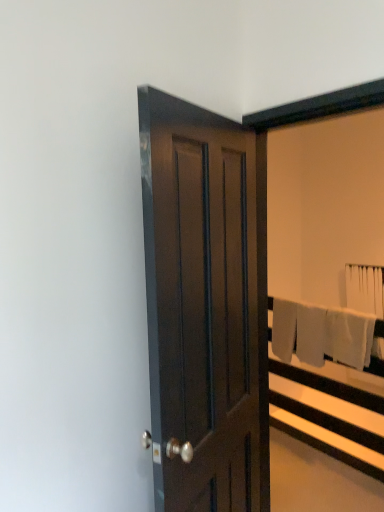
Question: From the image's perspective, is dark wood door at center below white cotton bath towel at right, which is the second bath towel in back-to-front order?

Choices:
 (A) yes
 (B) no

Answer: (B)

Question: Does dark wood door at center appear on the right side of white cotton bath towel at right, positioned as the 1th bath towel in bottom-to-top order?

Choices:
 (A) yes
 (B) no

Answer: (B)

Question: From a real-world perspective, is dark wood door at center beneath white cotton bath towel at right, marked as the 2th bath towel in a top-to-bottom arrangement?

Choices:
 (A) yes
 (B) no

Answer: (B)

Question: Is dark wood door at center smaller than white cotton bath towel at right, acting as the 2th bath towel starting from the right?

Choices:
 (A) yes
 (B) no

Answer: (B)

Question: Could you tell me if dark wood door at center is turned towards white cotton bath towel at right, marked as the 2th bath towel in a top-to-bottom arrangement?

Choices:
 (A) yes
 (B) no

Answer: (B)

Question: From a real-world perspective, does dark wood door at center stand above white cotton bath towel at right, the first bath towel when ordered from front to back?

Choices:
 (A) yes
 (B) no

Answer: (A)

Question: Can you confirm if dark wood door at center is positioned to the left of white fabric bath towel at upper right, arranged as the 2th bath towel when viewed from the front?

Choices:
 (A) yes
 (B) no

Answer: (A)

Question: Is white fabric bath towel at upper right, which appears as the second bath towel when viewed from the left, at the back of dark wood door at center?

Choices:
 (A) yes
 (B) no

Answer: (B)

Question: Considering the relative sizes of dark wood door at center and white fabric bath towel at upper right, the 1th bath towel when ordered from right to left, in the image provided, is dark wood door at center taller than white fabric bath towel at upper right, the 1th bath towel when ordered from right to left,?

Choices:
 (A) no
 (B) yes

Answer: (B)

Question: Is dark wood door at center to the right of white fabric bath towel at upper right, the 1th bath towel when ordered from right to left, from the viewer's perspective?

Choices:
 (A) no
 (B) yes

Answer: (A)

Question: From the image's perspective, is dark wood door at center located above white fabric bath towel at upper right, acting as the first bath towel starting from the back?

Choices:
 (A) yes
 (B) no

Answer: (B)

Question: Is dark wood door at center not inside white fabric bath towel at upper right, arranged as the 2th bath towel when viewed from the front?

Choices:
 (A) no
 (B) yes

Answer: (B)

Question: Is white fabric bed frame at right facing towards dark wood door at center?

Choices:
 (A) yes
 (B) no

Answer: (A)